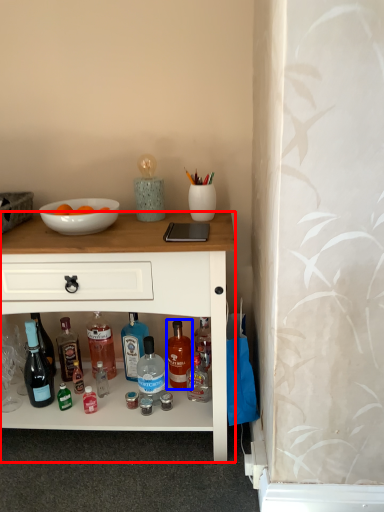
Question: Which object is further to the camera taking this photo, desk (highlighted by a red box) or bottle (highlighted by a blue box)?

Choices:
 (A) desk
 (B) bottle

Answer: (B)